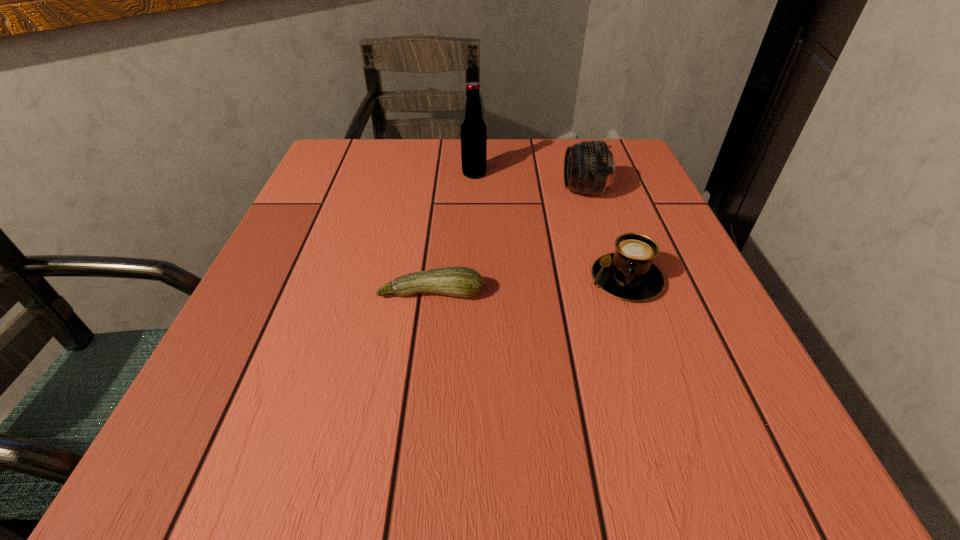
This screenshot has width=960, height=540. In order to click on unoccupied position between the zucchini and the tallest object in this screenshot , I will do `click(453, 233)`.

You are a GUI agent. You are given a task and a screenshot of the screen. Output one action in this format:
    pyautogui.click(x=<x>, y=<y>)
    Task: Click on the object that is the third closest one to the tallest object
    This screenshot has width=960, height=540.
    Given the screenshot: What is the action you would take?
    pyautogui.click(x=464, y=282)

Locate an element on the screen. The width and height of the screenshot is (960, 540). object that is the third closest one to the cappuccino is located at coordinates (473, 129).

You are a GUI agent. You are given a task and a screenshot of the screen. Output one action in this format:
    pyautogui.click(x=<x>, y=<y>)
    Task: Click on the vacant space that satisfies the following two spatial constraints: 1. at the front element of the telephoto lens; 2. on the right side of the cappuccino
    
    Given the screenshot: What is the action you would take?
    pyautogui.click(x=612, y=279)

Image resolution: width=960 pixels, height=540 pixels. I want to click on vacant space that satisfies the following two spatial constraints: 1. at the front element of the cappuccino; 2. on the right side of the telephoto lens, so click(612, 279).

Where is `free space that satisfies the following two spatial constraints: 1. at the front element of the third shortest object; 2. on the back side of the third tallest object`? The height and width of the screenshot is (540, 960). free space that satisfies the following two spatial constraints: 1. at the front element of the third shortest object; 2. on the back side of the third tallest object is located at coordinates (612, 279).

At what (x,y) coordinates should I click in order to perform the action: click on vacant region that satisfies the following two spatial constraints: 1. at the front element of the telephoto lens; 2. at the stem end of the zucchini. Please return your answer as a coordinate pair (x, y). This screenshot has width=960, height=540. Looking at the image, I should click on (617, 293).

At what (x,y) coordinates should I click in order to perform the action: click on blank area in the image that satisfies the following two spatial constraints: 1. at the front element of the third shortest object; 2. on the left side of the third tallest object. Please return your answer as a coordinate pair (x, y). This screenshot has width=960, height=540. Looking at the image, I should click on (612, 279).

Identify the location of free space that satisfies the following two spatial constraints: 1. on the front side of the cappuccino; 2. on the left side of the beer bottle. The height and width of the screenshot is (540, 960). (472, 279).